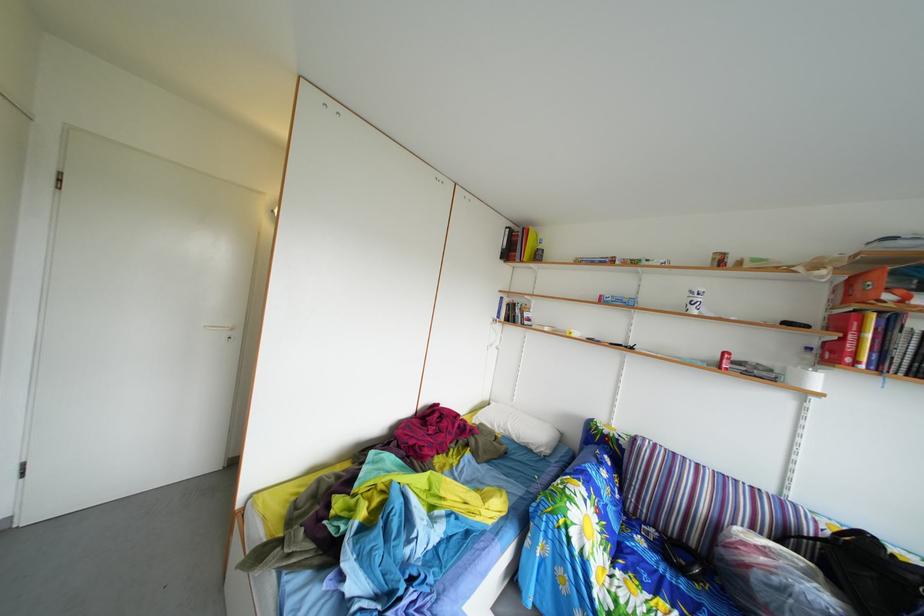
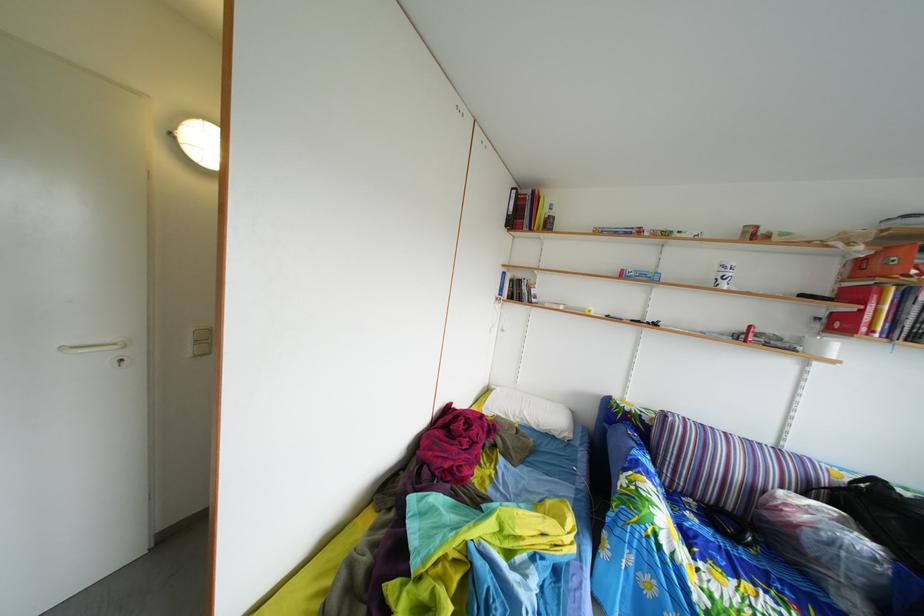
Locate, in the second image, the point that corresponds to pixel 529 447 in the first image.

(549, 434)